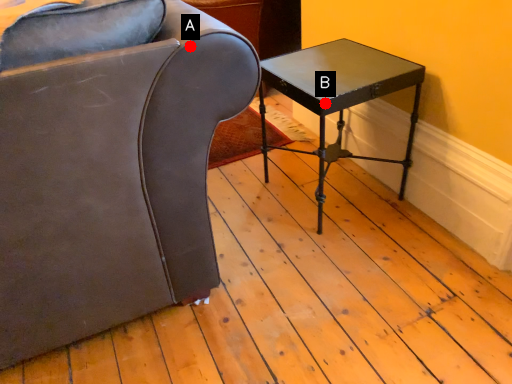
Question: Two points are circled on the image, labeled by A and B beside each circle. Which point appears closest to the camera in this image?

Choices:
 (A) A is closer
 (B) B is closer

Answer: (A)